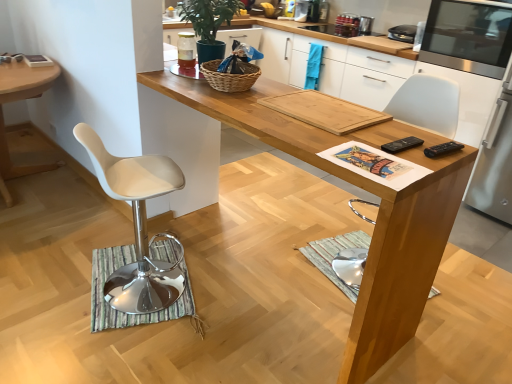
Where is `stainless steel microwave at right, arranged as the 4th appliance when viewed from the left`? This screenshot has height=384, width=512. stainless steel microwave at right, arranged as the 4th appliance when viewed from the left is located at coordinates (479, 88).

This screenshot has height=384, width=512. What do you see at coordinates (209, 24) in the screenshot?
I see `green matte plant at upper center` at bounding box center [209, 24].

What do you see at coordinates (324, 111) in the screenshot? The image size is (512, 384). I see `wooden cutting board at center` at bounding box center [324, 111].

You are a GUI agent. You are given a task and a screenshot of the screen. Output one action in this format:
    pyautogui.click(x=<x>, y=<y>)
    Task: Click on the light brown wood desk at center, the 2th desk viewed from the left
    
    Given the screenshot: What is the action you would take?
    pyautogui.click(x=378, y=213)

Describe the element at coordinates (230, 76) in the screenshot. Image resolution: width=512 pixels, height=384 pixels. I see `woven brown basket at center` at that location.

At what (x,y) coordinates should I click in order to perform the action: click on stainless steel microwave at right, arranged as the 4th appliance when viewed from the left. Please return your answer as a coordinate pair (x, y). The image size is (512, 384). Looking at the image, I should click on (479, 88).

From the image's perspective, who appears lower, white plastic chair at left or woven brown basket at center?

white plastic chair at left appears lower in the image.

Considering the points (144, 176) and (249, 79), which point is in front, point (144, 176) or point (249, 79)?

The point (144, 176) is in front.

Identify the location of basket above the white plastic chair at left (from a real-world perspective). (230, 76).

Looking at this image, what's the angular difference between white plastic chair at left and woven brown basket at center's facing directions?

The angular difference between white plastic chair at left and woven brown basket at center is 21.1 degrees.

Is wooden cutting board at center positioned far away from metallic silver toaster at upper center, placed as the third appliance when sorted from right to left?

Indeed, wooden cutting board at center is not near metallic silver toaster at upper center, placed as the third appliance when sorted from right to left.

Is wooden cutting board at center taller or shorter than metallic silver toaster at upper center, placed as the third appliance when sorted from right to left?

wooden cutting board at center is shorter than metallic silver toaster at upper center, placed as the third appliance when sorted from right to left.

Which is in front, wooden cutting board at center or metallic silver toaster at upper center, placed as the third appliance when sorted from right to left?

wooden cutting board at center.

From a real-world perspective, relative to woven brown basket at center, is stainless steel microwave at upper right, the third appliance in the left-to-right sequence, vertically above or below?

In terms of real-world spatial position, stainless steel microwave at upper right, the third appliance in the left-to-right sequence, is above woven brown basket at center.

How many degrees apart are the facing directions of stainless steel microwave at upper right, the third appliance in the left-to-right sequence, and woven brown basket at center?

178 degrees separate the facing orientations of stainless steel microwave at upper right, the third appliance in the left-to-right sequence, and woven brown basket at center.

Can you confirm if stainless steel microwave at upper right, the third appliance in the left-to-right sequence, is taller than woven brown basket at center?

Yes, stainless steel microwave at upper right, the third appliance in the left-to-right sequence, is taller than woven brown basket at center.

Can you see stainless steel microwave at upper right, the third appliance in the left-to-right sequence, touching woven brown basket at center?

No, stainless steel microwave at upper right, the third appliance in the left-to-right sequence, is not next to woven brown basket at center.

Can you confirm if green matte plant at upper center is smaller than wooden cutting board at center?

Incorrect, green matte plant at upper center is not smaller in size than wooden cutting board at center.

Where is `magazine below the green matte plant at upper center (from a real-world perspective)`? This screenshot has width=512, height=384. magazine below the green matte plant at upper center (from a real-world perspective) is located at coordinates (324, 111).

Which is more to the right, green matte plant at upper center or wooden cutting board at center?

Positioned to the right is wooden cutting board at center.

From a real-world perspective, which object rests below the other?

wooden cutting board at center, from a real-world perspective.

From the picture: Which object is positioned more to the left, clear glass jar at upper center, which is the 4th appliance from right to left, or green matte plant at upper center?

From the viewer's perspective, clear glass jar at upper center, which is the 4th appliance from right to left, appears more on the left side.

Is clear glass jar at upper center, which is the 4th appliance from right to left, positioned before green matte plant at upper center?

No, clear glass jar at upper center, which is the 4th appliance from right to left, is behind green matte plant at upper center.

Does clear glass jar at upper center, the first appliance when ordered from left to right, have a greater height compared to green matte plant at upper center?

No.

From a real-world perspective, who is located higher, clear glass jar at upper center, the first appliance when ordered from left to right, or green matte plant at upper center?

green matte plant at upper center, from a real-world perspective.

Is wooden cutting board at center oriented away from white plastic chair at left?

wooden cutting board at center is not turned away from white plastic chair at left.

Is white plastic chair at left inside wooden cutting board at center?

No, white plastic chair at left is located outside of wooden cutting board at center.

Between point (321, 103) and point (138, 258), which one is positioned in front?

Point (321, 103)

From a real-world perspective, who is located higher, wooden cutting board at center or white plastic chair at left?

wooden cutting board at center.

Is point (50, 76) positioned after point (149, 286)?

Yes, it is behind point (149, 286).

Is white plastic chair at left, the second desk in the right-to-left sequence, to the left or to the right of white plastic chair at left in the image?

white plastic chair at left, the second desk in the right-to-left sequence, is to the left of white plastic chair at left.

Does white plastic chair at left, the second desk in the right-to-left sequence, have a lesser height compared to white plastic chair at left?

Answer: Indeed, white plastic chair at left, the second desk in the right-to-left sequence, has a lesser height compared to white plastic chair at left.

This screenshot has height=384, width=512. What are the coordinates of `basket above the white plastic chair at left (from a real-world perspective)` in the screenshot? It's located at (230, 76).

There is a wooden cutting board at center. What are the coordinates of `the 4th appliance above it (from the image's perspective)` in the screenshot? It's located at (347, 25).

Which object lies nearer to the anchor point stainless steel microwave at right, the 1th appliance when ordered from right to left, white plastic chair at left or wooden cutting board at center?

The object closer to stainless steel microwave at right, the 1th appliance when ordered from right to left, is wooden cutting board at center.

When comparing their distances from white plastic chair at left, does metallic silver toaster at upper center, the 2th appliance from the left, or white plastic chair at left, the second desk in the right-to-left sequence, seem further?

Based on the image, metallic silver toaster at upper center, the 2th appliance from the left, appears to be further to white plastic chair at left.

When comparing their distances from clear glass jar at upper center, the first appliance when ordered from left to right, does green matte plant at upper center or metallic silver toaster at upper center, placed as the third appliance when sorted from right to left, seem further?

metallic silver toaster at upper center, placed as the third appliance when sorted from right to left, is further to clear glass jar at upper center, the first appliance when ordered from left to right.

Estimate the real-world distances between objects in this image. Which object is closer to woven brown basket at center, light brown wood desk at center, which is counted as the first desk, starting from the right, or metallic silver toaster at upper center, placed as the third appliance when sorted from right to left?

light brown wood desk at center, which is counted as the first desk, starting from the right, lies closer to woven brown basket at center than the other object.

When comparing their distances from light brown wood desk at center, which is counted as the first desk, starting from the right, does metallic silver toaster at upper center, the 2th appliance from the left, or green matte plant at upper center seem further?

Based on the image, metallic silver toaster at upper center, the 2th appliance from the left, appears to be further to light brown wood desk at center, which is counted as the first desk, starting from the right.

Looking at the image, which one is located closer to wooden cutting board at center, white plastic chair at left, the 1th desk from the left, or metallic silver toaster at upper center, placed as the third appliance when sorted from right to left?

white plastic chair at left, the 1th desk from the left, is closer to wooden cutting board at center.

Considering their positions, is stainless steel microwave at right, the 1th appliance when ordered from right to left, positioned closer to white plastic chair at left, the 1th desk from the left, than wooden cutting board at center?

wooden cutting board at center is closer to white plastic chair at left, the 1th desk from the left.

When comparing their distances from green matte plant at upper center, does wooden cutting board at center or white plastic chair at left, the 1th desk from the left, seem further?

Among the two, white plastic chair at left, the 1th desk from the left, is located further to green matte plant at upper center.

Locate an element on the screen. This screenshot has width=512, height=384. magazine between light brown wood desk at center, which is counted as the first desk, starting from the right, and stainless steel microwave at right, the 1th appliance when ordered from right to left, in the horizontal direction is located at coordinates (324, 111).

You are a GUI agent. You are given a task and a screenshot of the screen. Output one action in this format:
    pyautogui.click(x=<x>, y=<y>)
    Task: Click on the plant between white plastic chair at left, the second desk in the right-to-left sequence, and woven brown basket at center from left to right
    
    Given the screenshot: What is the action you would take?
    pyautogui.click(x=209, y=24)

Identify the location of basket between white plastic chair at left, the second desk in the right-to-left sequence, and stainless steel microwave at right, arranged as the 4th appliance when viewed from the left. (230, 76).

Locate an element on the screen. This screenshot has height=384, width=512. cabinetry located between clear glass jar at upper center, the first appliance when ordered from left to right, and metallic silver toaster at upper center, the 2th appliance from the left, in the depth direction is located at coordinates (360, 76).